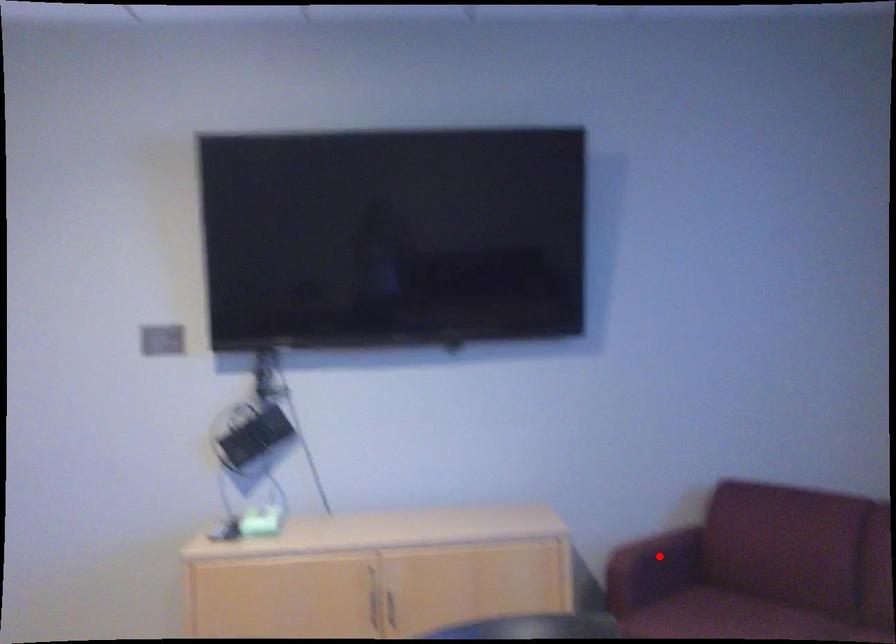
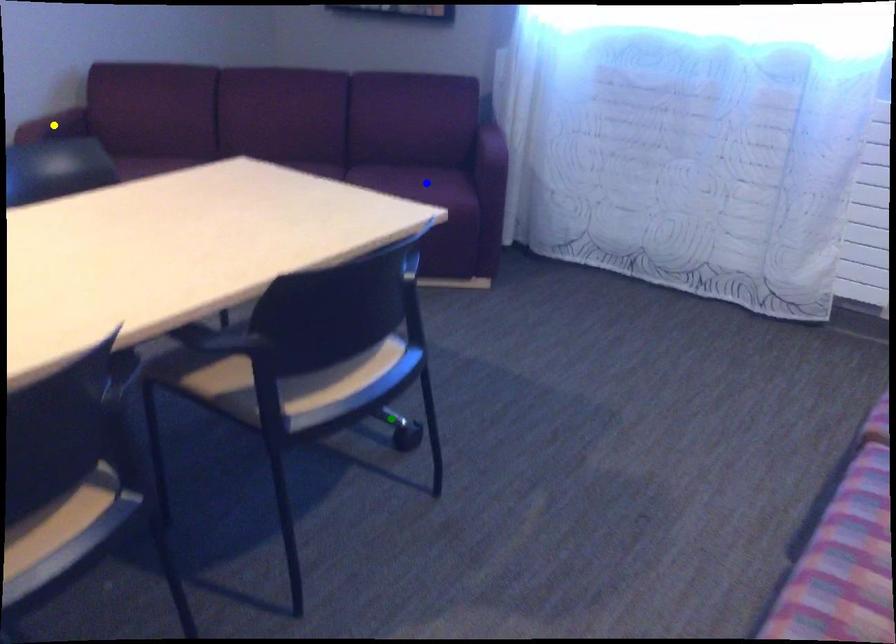
Question: I am providing you with two images of the same scene from different viewpoints. A red point is marked on the first image. You are given multiple points on the second image. Which point in image 2 is actually the same real-world point as the red point in image 1?

Choices:
 (A) yellow point
 (B) green point
 (C) blue point

Answer: (A)